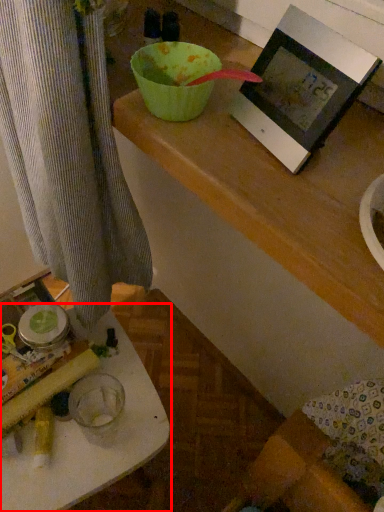
Question: From the image's perspective, where is table (annotated by the red box) located in relation to picture frame in the image?

Choices:
 (A) above
 (B) below

Answer: (B)